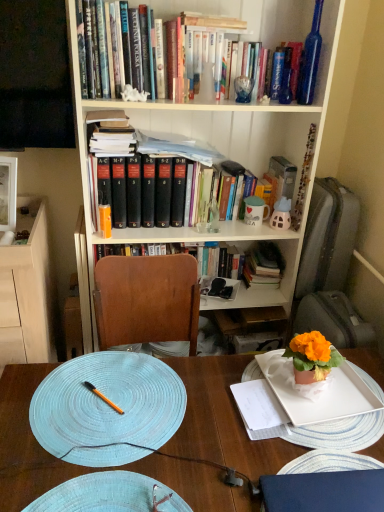
The height and width of the screenshot is (512, 384). What are the coordinates of `empty space that is in between blue woven placemat at center, which is the 3th plate from right to left, and white paper notebook at center` in the screenshot? It's located at (215, 402).